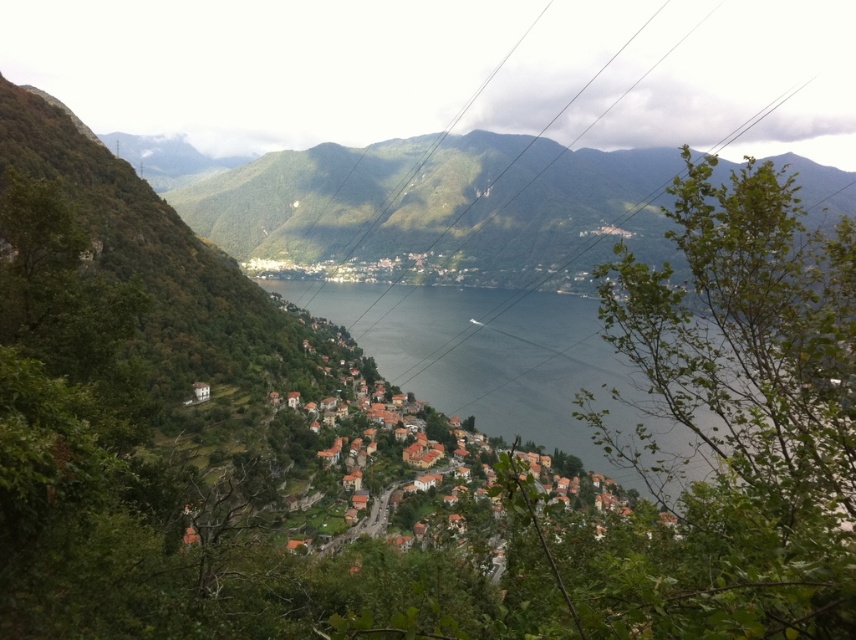
Between green matte mountain at center and clear water at center, which one is positioned higher?

green matte mountain at center

From the picture: Does green matte mountain at center come behind clear water at center?

Yes.

Does point (660, 218) come in front of point (423, 376)?

No, (660, 218) is behind (423, 376).

The height and width of the screenshot is (640, 856). Find the location of `green matte mountain at center`. green matte mountain at center is located at coordinates tap(440, 205).